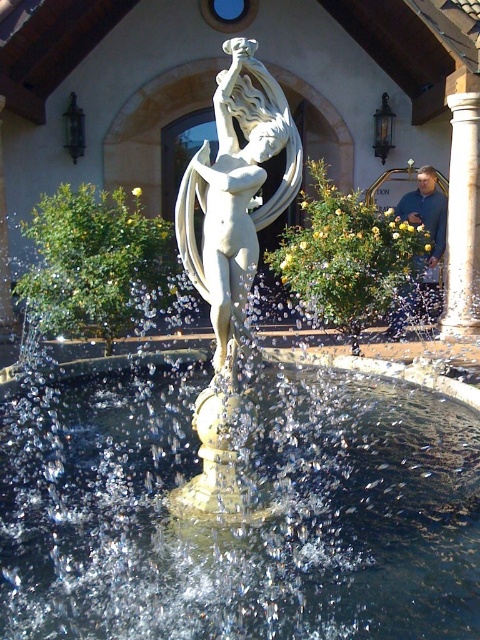
Is clear water at center behind white marble statue at center?

Yes, it is.

Can you confirm if clear water at center is positioned above white marble statue at center?

Actually, clear water at center is below white marble statue at center.

Between point (211, 490) and point (243, 250), which one is positioned behind?

The point (211, 490) is behind.

The height and width of the screenshot is (640, 480). In order to click on clear water at center in this screenshot , I will do `click(236, 508)`.

Does clear water at center have a lesser width compared to white marble pillar at right?

No.

Is clear water at center taller than white marble pillar at right?

No.

What do you see at coordinates (236, 508) in the screenshot?
I see `clear water at center` at bounding box center [236, 508].

The height and width of the screenshot is (640, 480). Identify the location of clear water at center. (236, 508).

Can you confirm if white marble statue at center is bigger than white marble pillar at right?

Incorrect, white marble statue at center is not larger than white marble pillar at right.

Consider the image. Between white marble statue at center and white marble pillar at right, which one is positioned higher?

white marble pillar at right is above.

Which is behind, point (216, 96) or point (457, 332)?

The point (457, 332) is behind.

At what (x,y) coordinates should I click in order to perform the action: click on white marble statue at center. Please return your answer as a coordinate pair (x, y). The image size is (480, 640). Looking at the image, I should click on (236, 193).